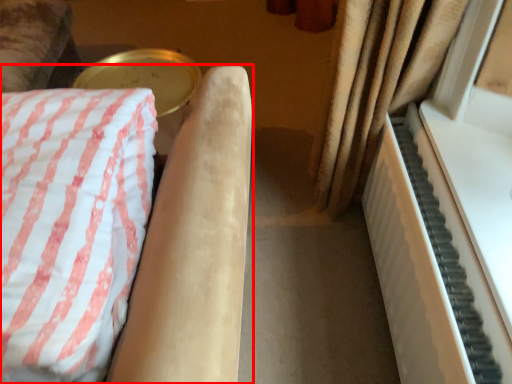
Question: From the image's perspective, considering the relative positions of furniture (annotated by the red box) and piano in the image provided, where is furniture (annotated by the red box) located with respect to the staircase?

Choices:
 (A) above
 (B) below

Answer: (A)